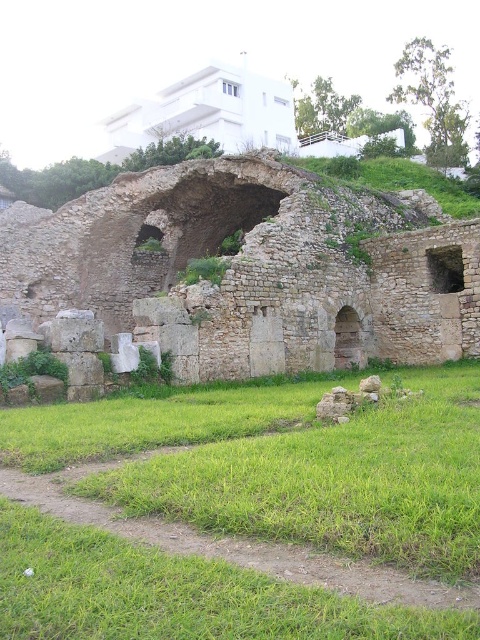
Is green grass at center below stone archway at center?

Yes, green grass at center is below stone archway at center.

Consider the image. Who is more forward, (444,444) or (444,323)?

Point (444,444) is in front.

You are a GUI agent. You are given a task and a screenshot of the screen. Output one action in this format:
    pyautogui.click(x=<x>, y=<y>)
    Task: Click on the green grass at center
    The width and height of the screenshot is (480, 640).
    Given the screenshot: What is the action you would take?
    pyautogui.click(x=288, y=461)